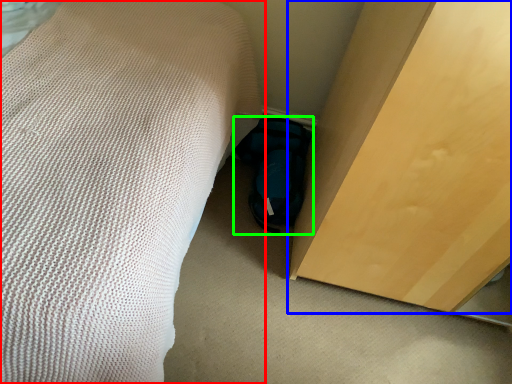
Question: Which object is the closest to the bed (highlighted by a red box)? Choose among these: furniture (highlighted by a blue box) or footwear (highlighted by a green box).

Choices:
 (A) furniture
 (B) footwear

Answer: (A)